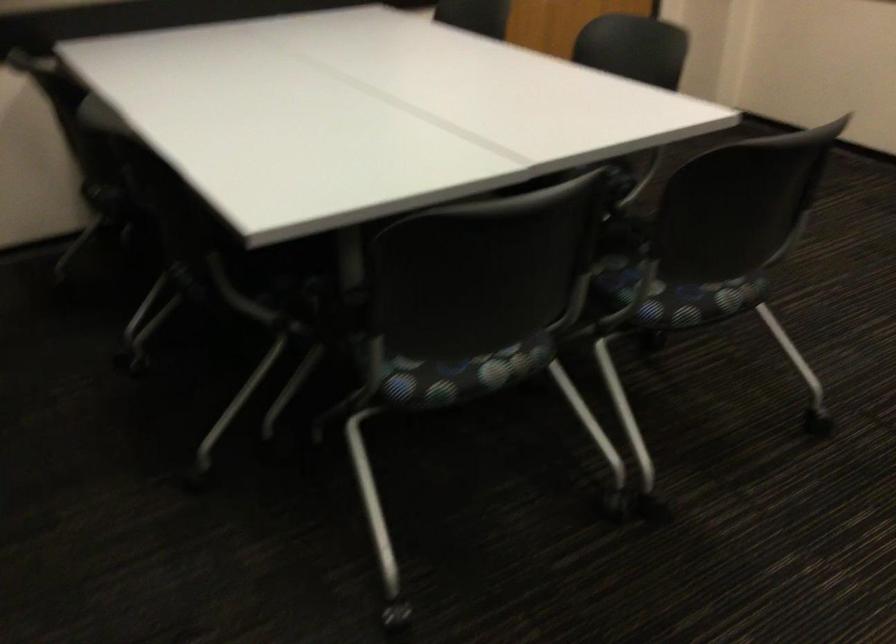
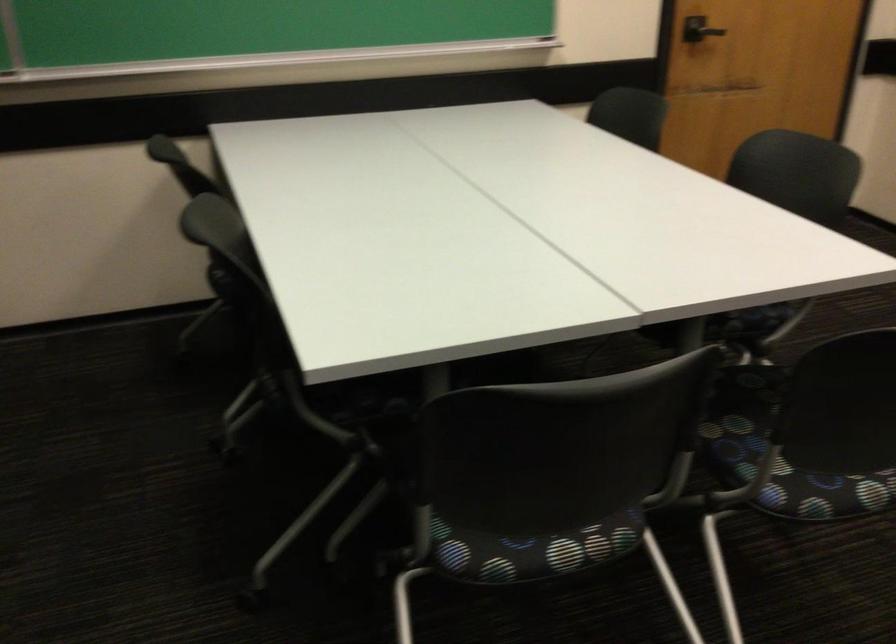
In the second image, find the point that corresponds to (x=693, y=303) in the first image.

(823, 493)